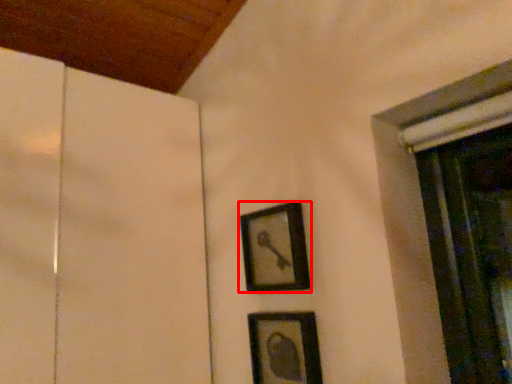
Question: From the image's perspective, what is the correct spatial relationship of picture frame (annotated by the red box) in relation to picture frame?

Choices:
 (A) below
 (B) above

Answer: (B)